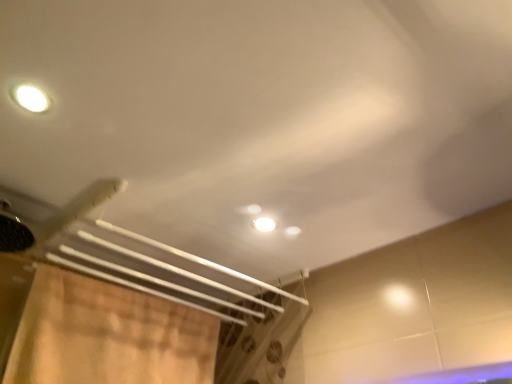
This screenshot has height=384, width=512. In order to click on beige fabric curtain at lower left in this screenshot , I will do click(x=106, y=335).

In order to face beige fabric curtain at lower left, should I rotate leftwards or rightwards?

You should look left and rotate roughly 16.561 degrees.

Describe the element at coordinates (106, 335) in the screenshot. I see `beige fabric curtain at lower left` at that location.

Locate an element on the screen. beige fabric curtain at lower left is located at coordinates (106, 335).